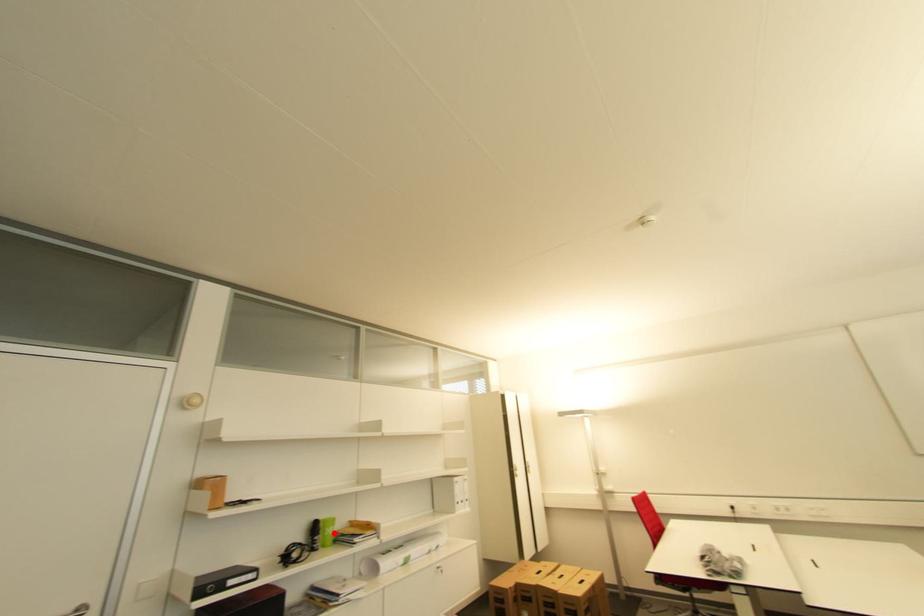
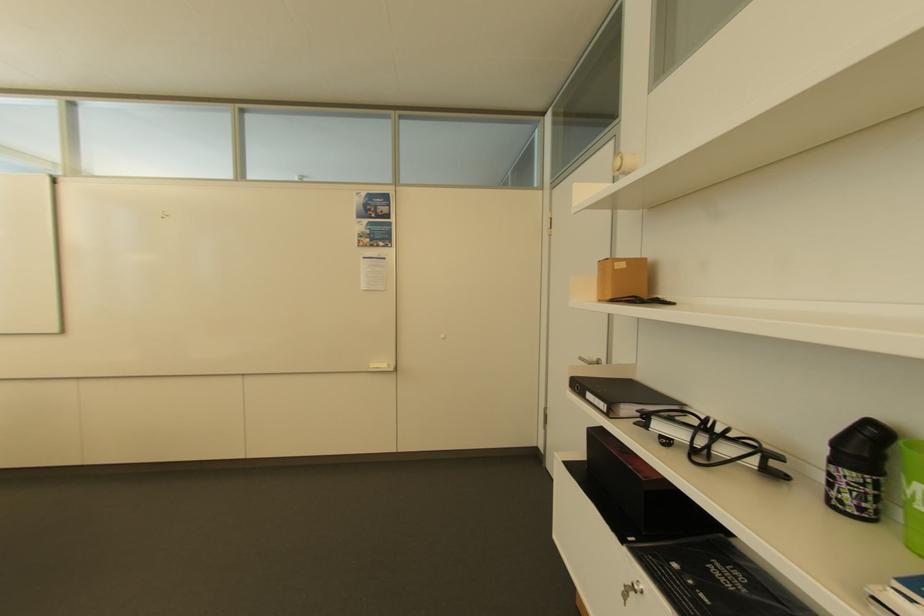
The point at the highlighted location is marked in the first image. Where is the corresponding point in the second image?

(916, 493)